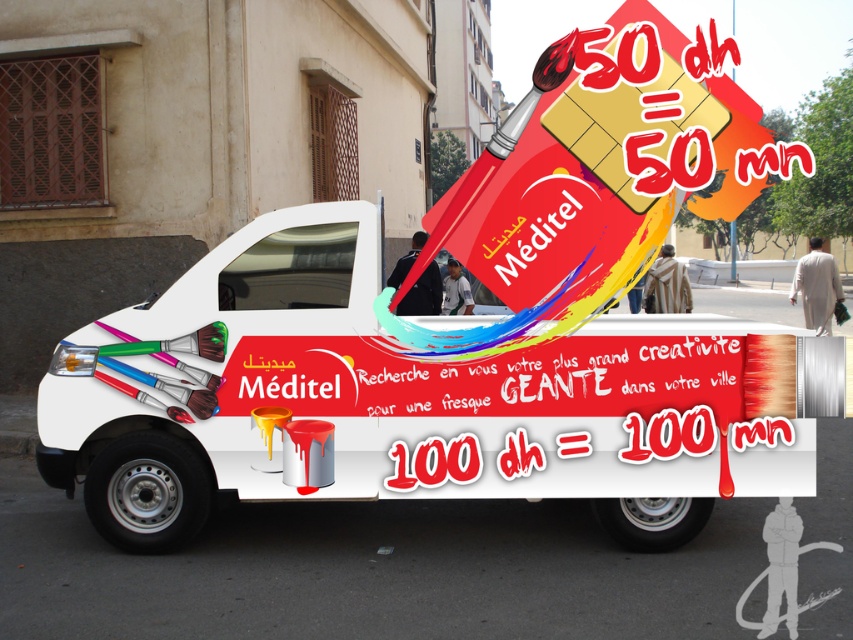
You are an artist trying to load a metallic paint can at center onto the white matte truck at center. The truck has a loading ramp that can only accommodate items up to the truck width. Can the paint can fit on the ramp without overhanging?

The white matte truck at center might be wider than metallic paint can at center, so there is a possibility that the paint can will fit on the ramp without overhanging, but the exact dimensions are uncertain based on the provided information.

You are standing 5 meters away from the white matte truck at center. Can you comfortably read the text on the truck from this distance?

The distance between you and the white matte truck at center is 5.08 meters, which is just over 5 meters. Whether you can comfortably read the text depends on factors like your eyesight and the text size, but typically, large promotional text like this can be read from such a distance. However, since the exact text size isn

You are a delivery person who needs to place a metallic paint can at center onto the white matte truck at center. The truck has a loading ramp that is 20 centimeters wide. Will the paint can fit through the ramp?

The white matte truck at center and metallic paint can at center are 21.90 centimeters apart from each other. Since the loading ramp is only 20 centimeters wide, the paint can will not fit through the ramp as it is wider than the ramp.